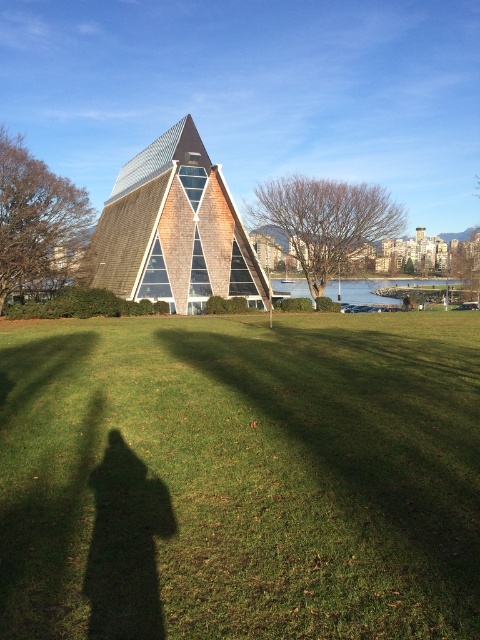
You are standing in the park and want to take a photo of the wooden shingles pyramid at center and the clear blue water at lower center. Which object should you focus on first if you want both to be in sharp focus?

The wooden shingles pyramid at center is in front of clear blue water at lower center, so you should focus on the wooden shingles pyramid at center first to ensure both are in sharp focus.

You are standing at the center of the park and want to locate the wooden shingles pyramid at center. According to the coordinates provided, in which direction should you look to find it?

The wooden shingles pyramid at center is located at coordinates point (173, 230), so you should look towards the lower left direction to find it.

You are standing in the park and want to take a photo of the green grass at center and the clear blue water at lower center. Which object will appear larger in your photo?

The green grass at center will appear larger in the photo because it is closer to the viewer than the clear blue water at lower center.